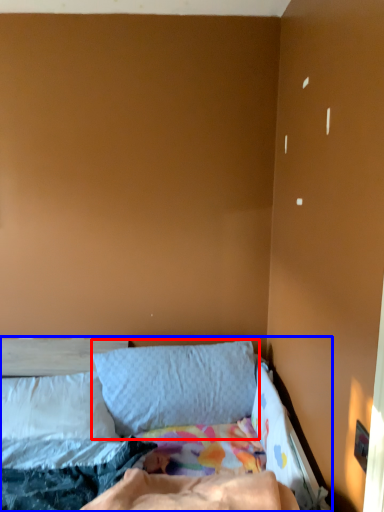
Question: Which object is closer to the camera taking this photo, pillow (highlighted by a red box) or bed (highlighted by a blue box)?

Choices:
 (A) pillow
 (B) bed

Answer: (B)